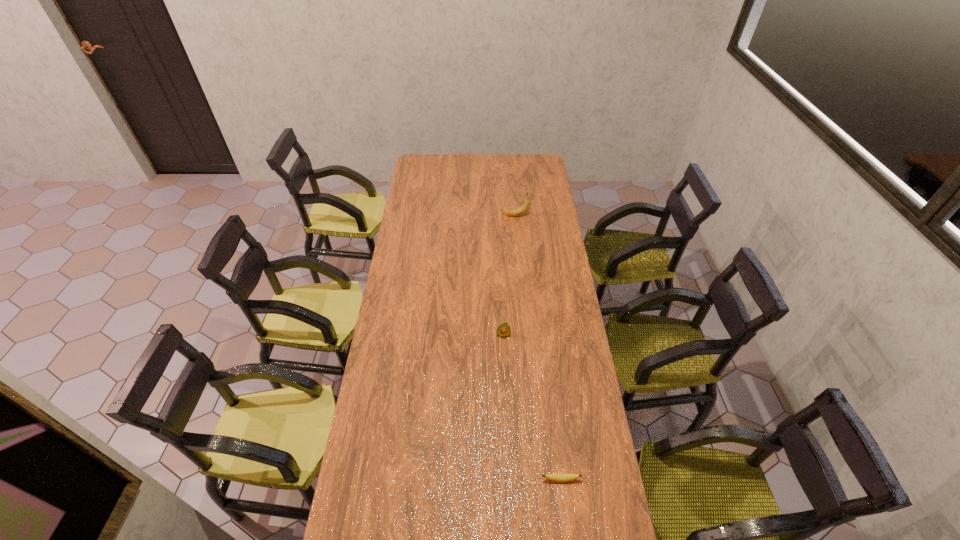
At what (x,y) coordinates should I click in order to perform the action: click on free space in the image that satisfies the following two spatial constraints: 1. at the start of the peel on the nearer banana; 2. on the left side of the tallest object. Please return your answer as a coordinate pair (x, y). The width and height of the screenshot is (960, 540). Looking at the image, I should click on (539, 479).

At what (x,y) coordinates should I click in order to perform the action: click on free location that satisfies the following two spatial constraints: 1. on the cut side of the second farthest object; 2. on the right side of the shorter banana. Please return your answer as a coordinate pair (x, y). The height and width of the screenshot is (540, 960). Looking at the image, I should click on (510, 479).

This screenshot has width=960, height=540. I want to click on vacant space that satisfies the following two spatial constraints: 1. on the cut side of the nearer banana; 2. on the left side of the second tallest object, so click(510, 479).

I want to click on vacant point that satisfies the following two spatial constraints: 1. at the start of the peel on the farther banana; 2. on the cut side of the avocado, so click(x=526, y=335).

Where is `free location that satisfies the following two spatial constraints: 1. on the back side of the shortest object; 2. at the start of the peel on the taller banana`? free location that satisfies the following two spatial constraints: 1. on the back side of the shortest object; 2. at the start of the peel on the taller banana is located at coordinates (529, 216).